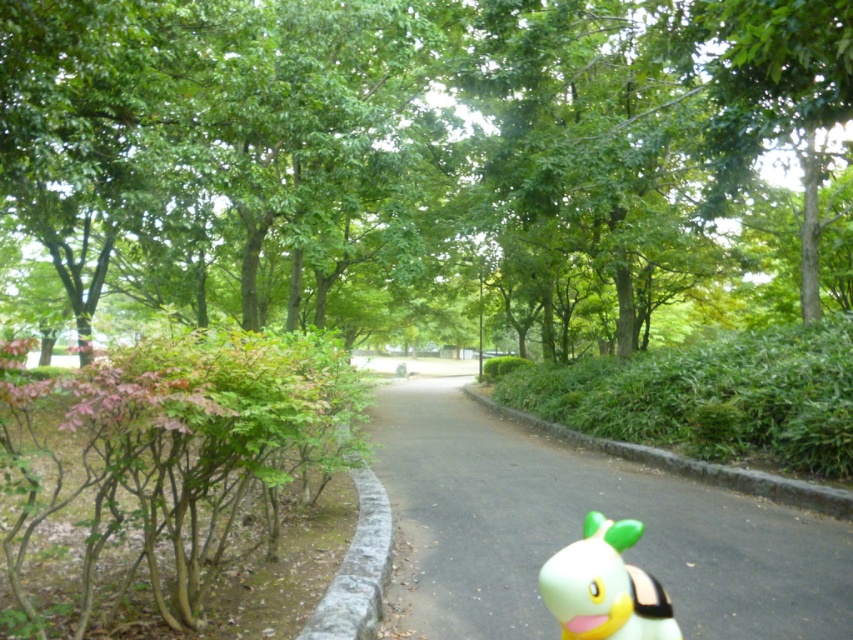
Does green leafy tree at center lie in front of yellow rubber duck at lower right?

No.

Does green leafy tree at center appear over yellow rubber duck at lower right?

Indeed, green leafy tree at center is positioned over yellow rubber duck at lower right.

Locate an element on the screen. The width and height of the screenshot is (853, 640). green leafy tree at center is located at coordinates (424, 164).

This screenshot has width=853, height=640. Identify the location of green leafy tree at center. (424, 164).

Is point (554, 29) less distant than point (790, 518)?

No, (554, 29) is behind (790, 518).

Where is `green leafy tree at center`? green leafy tree at center is located at coordinates (424, 164).

Can you confirm if black asphalt path at center is positioned above yellow rubber duck at lower right?

No, black asphalt path at center is not above yellow rubber duck at lower right.

In the scene shown: Between black asphalt path at center and yellow rubber duck at lower right, which one is positioned lower?

Positioned lower is black asphalt path at center.

Find the location of a particular element. The image size is (853, 640). black asphalt path at center is located at coordinates (579, 531).

What are the coordinates of `black asphalt path at center` in the screenshot? It's located at (579, 531).